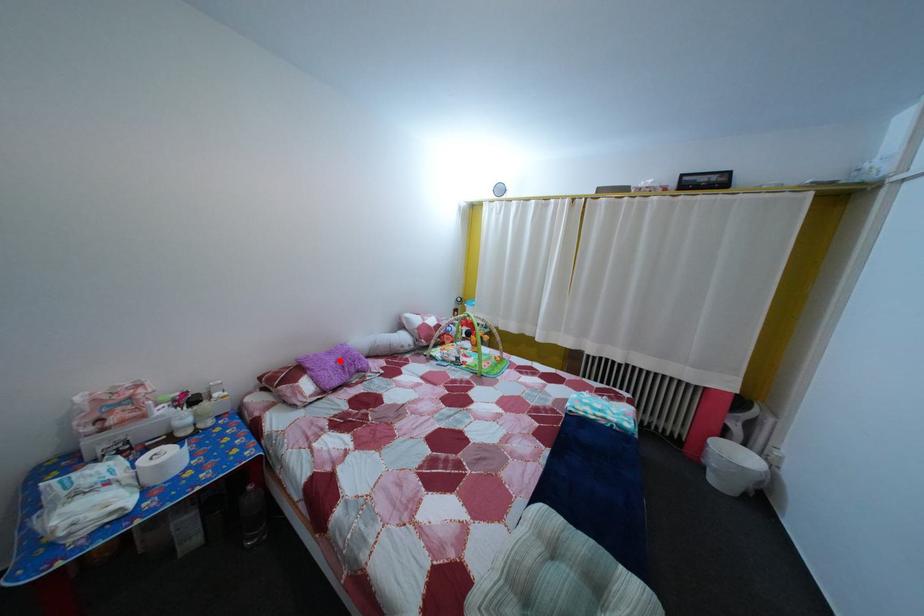
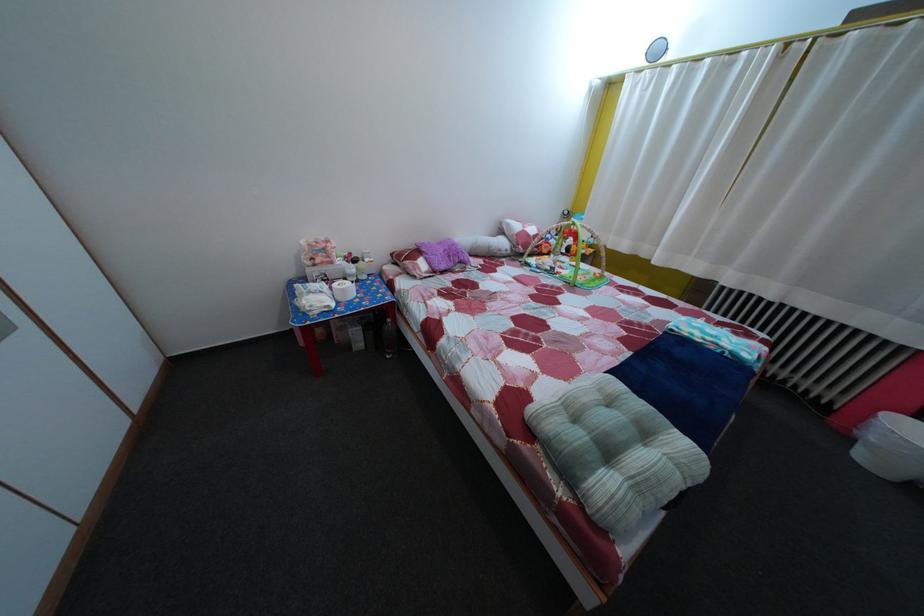
Question: I am providing you with two images of the same scene from different viewpoints. A red point is shown in image1. For the corresponding object point in image2, is it positioned nearer or farther from the camera?

Choices:
 (A) Nearer
 (B) Farther

Answer: (B)